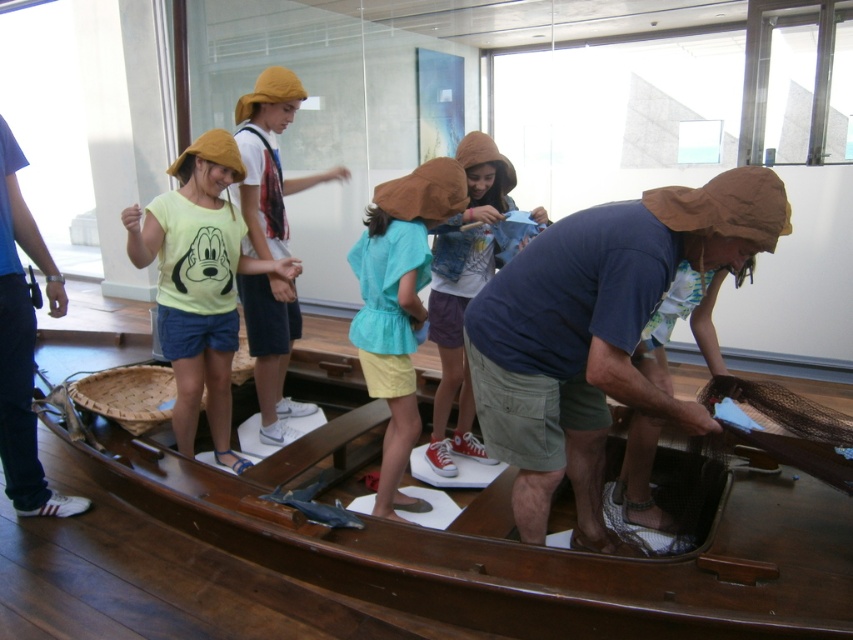
Does point (158, 486) lie in front of point (540, 352)?

No, (158, 486) is further to viewer.

Does point (780, 538) come behind point (505, 372)?

Yes, point (780, 538) is farther from viewer.

Does point (836, 525) come in front of point (503, 346)?

No, it is behind (503, 346).

This screenshot has height=640, width=853. Find the location of `wooden boat at center`. wooden boat at center is located at coordinates (527, 560).

Is light blue cotton shirt at center to the right of denim jacket at center from the viewer's perspective?

In fact, light blue cotton shirt at center is to the left of denim jacket at center.

Is point (401, 323) behind point (461, 259)?

No, (401, 323) is in front of (461, 259).

Is point (419, 209) in front of point (473, 147)?

Yes, it is in front of point (473, 147).

Identify the location of light blue cotton shirt at center. (398, 305).

Who is positioned more to the left, brown fabric hat at center or denim jacket at center?

denim jacket at center

You are a GUI agent. You are given a task and a screenshot of the screen. Output one action in this format:
    pyautogui.click(x=<x>, y=<y>)
    Task: Click on the brown fabric hat at center
    Image resolution: width=853 pixels, height=640 pixels.
    Given the screenshot: What is the action you would take?
    pyautogui.click(x=598, y=330)